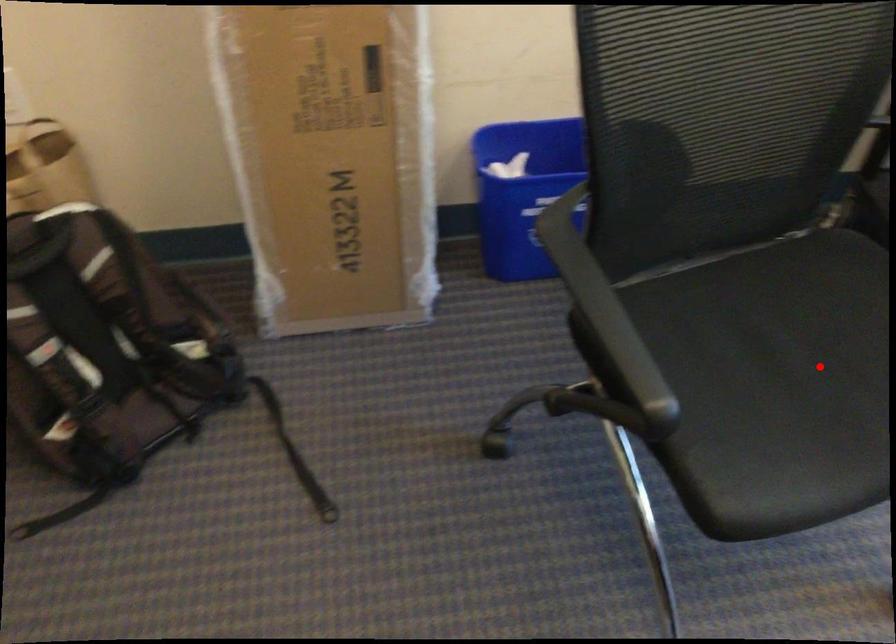
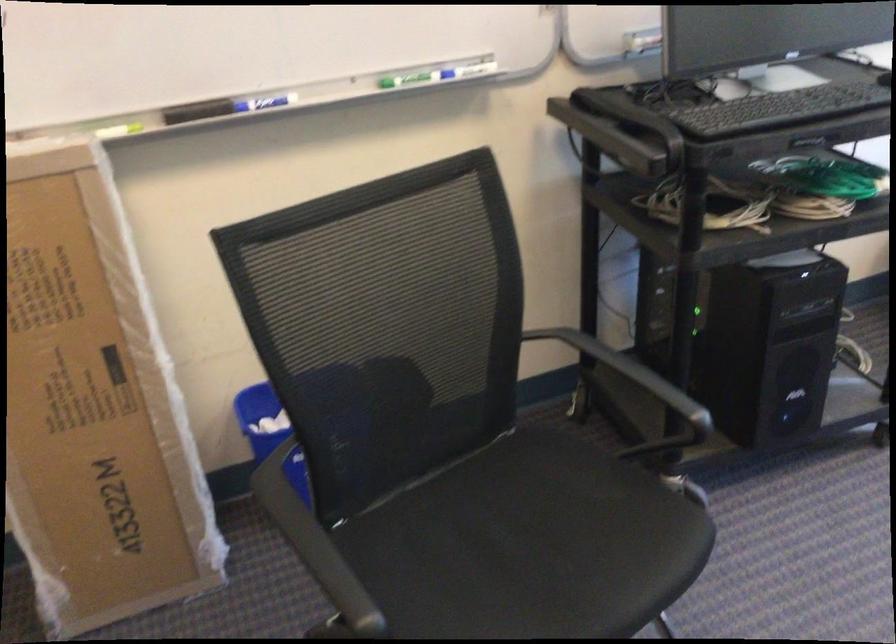
Find the pixel in the second image that matches the highlighted location in the first image.

(530, 545)